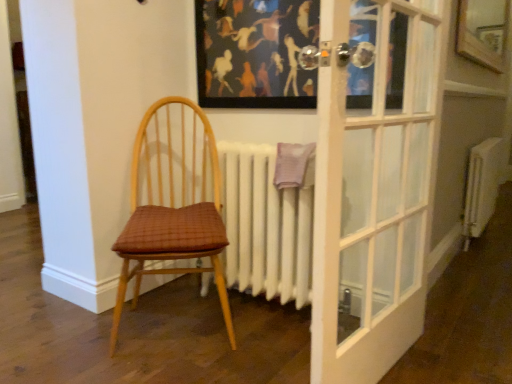
You are a GUI agent. You are given a task and a screenshot of the screen. Output one action in this format:
    pyautogui.click(x=<x>, y=<y>)
    Task: Click on the wooden chair with woven seat cushion at left
    Image resolution: width=512 pixels, height=384 pixels.
    Given the screenshot: What is the action you would take?
    pyautogui.click(x=173, y=201)

Locate an element on the screen. This screenshot has width=512, height=384. matte black picture frame at upper center is located at coordinates (255, 53).

Who is more distant, white matte radiator at center, acting as the second radiator starting from the right, or wooden chair with woven seat cushion at left?

white matte radiator at center, acting as the second radiator starting from the right, is behind.

Is white matte radiator at center, the 2th radiator from the back, spatially inside wooden chair with woven seat cushion at left, or outside of it?

The correct answer is: outside.

Is white matte radiator at center, acting as the second radiator starting from the right, turned away from wooden chair with woven seat cushion at left?

No, wooden chair with woven seat cushion at left is not at the back of white matte radiator at center, acting as the second radiator starting from the right.

How different are the orientations of white matte radiator at center, the 2th radiator from the back, and wooden chair with woven seat cushion at left in degrees?

They differ by 39.9 degrees in their facing directions.

Which object is further away from the camera taking this photo, wooden frame at upper right or white matte radiator at center, marked as the first radiator in a left-to-right arrangement?

wooden frame at upper right is more distant.

Between wooden frame at upper right and white matte radiator at center, which ranks as the 1th radiator in front-to-back order, which one has more height?

Standing taller between the two is white matte radiator at center, which ranks as the 1th radiator in front-to-back order.

Is wooden frame at upper right positioned with its back to white matte radiator at center, acting as the second radiator starting from the right?

wooden frame at upper right is not turned away from white matte radiator at center, acting as the second radiator starting from the right.

Considering the sizes of objects wooden frame at upper right and white matte radiator at center, acting as the second radiator starting from the right, in the image provided, who is bigger, wooden frame at upper right or white matte radiator at center, acting as the second radiator starting from the right,?

white matte radiator at center, acting as the second radiator starting from the right, is bigger.

Does wooden frame at upper right have a lesser width compared to matte black picture frame at upper center?

Yes, wooden frame at upper right is thinner than matte black picture frame at upper center.

Considering the sizes of wooden frame at upper right and matte black picture frame at upper center in the image, is wooden frame at upper right bigger or smaller than matte black picture frame at upper center?

Considering their sizes, wooden frame at upper right takes up more space than matte black picture frame at upper center.

Is wooden frame at upper right in front of or behind matte black picture frame at upper center in the image?

wooden frame at upper right is positioned farther from the viewer than matte black picture frame at upper center.

Is matte black picture frame at upper center wider than white metallic radiator at right, the 2th radiator from the left?

No.

From the image's perspective, which one is positioned higher, matte black picture frame at upper center or white metallic radiator at right, which is the 1th radiator in back-to-front order?

matte black picture frame at upper center is shown above in the image.

Is matte black picture frame at upper center facing towards white metallic radiator at right, marked as the first radiator in a right-to-left arrangement?

No, matte black picture frame at upper center is not aimed at white metallic radiator at right, marked as the first radiator in a right-to-left arrangement.

Is matte black picture frame at upper center to the left of white metallic radiator at right, marked as the first radiator in a right-to-left arrangement, from the viewer's perspective?

Correct, you'll find matte black picture frame at upper center to the left of white metallic radiator at right, marked as the first radiator in a right-to-left arrangement.

Is white matte radiator at center, marked as the first radiator in a left-to-right arrangement, surrounding white metallic radiator at right, marked as the first radiator in a right-to-left arrangement?

No, white metallic radiator at right, marked as the first radiator in a right-to-left arrangement, is not inside white matte radiator at center, marked as the first radiator in a left-to-right arrangement.

Consider the image. From a real-world perspective, which is physically below, white matte radiator at center, acting as the second radiator starting from the right, or white metallic radiator at right, marked as the first radiator in a right-to-left arrangement?

In real-world perspective, white metallic radiator at right, marked as the first radiator in a right-to-left arrangement, is lower.

Which is in front, point (302, 250) or point (463, 233)?

The point (302, 250) is closer.

Where is `radiator in front of the white metallic radiator at right, which ranks as the 2th radiator in front-to-back order`? radiator in front of the white metallic radiator at right, which ranks as the 2th radiator in front-to-back order is located at coordinates (266, 225).

How many degrees apart are the facing directions of wooden chair with woven seat cushion at left and white matte radiator at center, which ranks as the 1th radiator in front-to-back order?

The angular difference between wooden chair with woven seat cushion at left and white matte radiator at center, which ranks as the 1th radiator in front-to-back order, is 39.9 degrees.

In the scene shown: From the image's perspective, is wooden chair with woven seat cushion at left above white matte radiator at center, acting as the second radiator starting from the right?

Correct, wooden chair with woven seat cushion at left appears higher than white matte radiator at center, acting as the second radiator starting from the right, in the image.

Can you confirm if wooden chair with woven seat cushion at left is bigger than white matte radiator at center, the 2th radiator from the back?

Correct, wooden chair with woven seat cushion at left is larger in size than white matte radiator at center, the 2th radiator from the back.

Considering the positions of point (143, 174) and point (227, 186), is point (143, 174) closer or farther from the camera than point (227, 186)?

Point (143, 174).

Which is in front, point (464, 15) or point (490, 194)?

The point (464, 15) is in front.

Consider the image. Based on their positions, is wooden frame at upper right located to the left or right of white metallic radiator at right, marked as the first radiator in a right-to-left arrangement?

Clearly, wooden frame at upper right is on the left of white metallic radiator at right, marked as the first radiator in a right-to-left arrangement, in the image.

From the image's perspective, which radiator is the 1st one below the wooden frame at upper right? Please provide its 2D coordinates.

[(481, 187)]

Which of these two, wooden frame at upper right or white metallic radiator at right, which ranks as the 2th radiator in front-to-back order, is thinner?

wooden frame at upper right.

Image resolution: width=512 pixels, height=384 pixels. In order to click on chair above the white matte radiator at center, acting as the second radiator starting from the right (from a real-world perspective) in this screenshot , I will do `click(173, 201)`.

Identify the location of radiator in front of the wooden frame at upper right. (266, 225).

Estimate the real-world distances between objects in this image. Which object is closer to wooden chair with woven seat cushion at left, wooden frame at upper right or white matte radiator at center, marked as the first radiator in a left-to-right arrangement?

Among the two, white matte radiator at center, marked as the first radiator in a left-to-right arrangement, is located nearer to wooden chair with woven seat cushion at left.

Which object lies nearer to the anchor point wooden chair with woven seat cushion at left, wooden frame at upper right or white metallic radiator at right, the 2th radiator from the left?

white metallic radiator at right, the 2th radiator from the left, is positioned closer to the anchor wooden chair with woven seat cushion at left.

Looking at the image, which one is located further to white matte radiator at center, acting as the second radiator starting from the right, wooden frame at upper right or white metallic radiator at right, which ranks as the 2th radiator in front-to-back order?

Among the two, wooden frame at upper right is located further to white matte radiator at center, acting as the second radiator starting from the right.

From the picture: Considering their positions, is matte black picture frame at upper center positioned further to white metallic radiator at right, marked as the first radiator in a right-to-left arrangement, than white matte radiator at center, which ranks as the 1th radiator in front-to-back order?

The object further to white metallic radiator at right, marked as the first radiator in a right-to-left arrangement, is matte black picture frame at upper center.

Based on their spatial positions, is wooden chair with woven seat cushion at left or matte black picture frame at upper center further from wooden frame at upper right?

wooden chair with woven seat cushion at left is positioned further to the anchor wooden frame at upper right.

From the image, which object appears to be farther from wooden frame at upper right, white metallic radiator at right, the 2th radiator from the left, or matte black picture frame at upper center?

matte black picture frame at upper center.

Based on the photo, based on their spatial positions, is wooden chair with woven seat cushion at left or white matte radiator at center, which ranks as the 1th radiator in front-to-back order, further from wooden frame at upper right?

wooden chair with woven seat cushion at left is positioned further to the anchor wooden frame at upper right.

When comparing their distances from white matte radiator at center, the 2th radiator from the back, does wooden frame at upper right or wooden chair with woven seat cushion at left seem closer?

wooden chair with woven seat cushion at left lies closer to white matte radiator at center, the 2th radiator from the back, than the other object.

Locate an element on the screen. This screenshot has height=384, width=512. picture frame located between wooden chair with woven seat cushion at left and white metallic radiator at right, which is the 1th radiator in back-to-front order, in the left-right direction is located at coordinates (255, 53).

This screenshot has height=384, width=512. In order to click on window situated between matte black picture frame at upper center and white metallic radiator at right, the 2th radiator from the left, from left to right in this screenshot , I will do `click(483, 32)`.

Locate an element on the screen. This screenshot has width=512, height=384. picture frame between white matte radiator at center, acting as the second radiator starting from the right, and wooden frame at upper right from left to right is located at coordinates (255, 53).

Find the location of `window between wooden chair with woven seat cushion at left and white metallic radiator at right, which is the 1th radiator in back-to-front order, from left to right`. window between wooden chair with woven seat cushion at left and white metallic radiator at right, which is the 1th radiator in back-to-front order, from left to right is located at coordinates (483, 32).